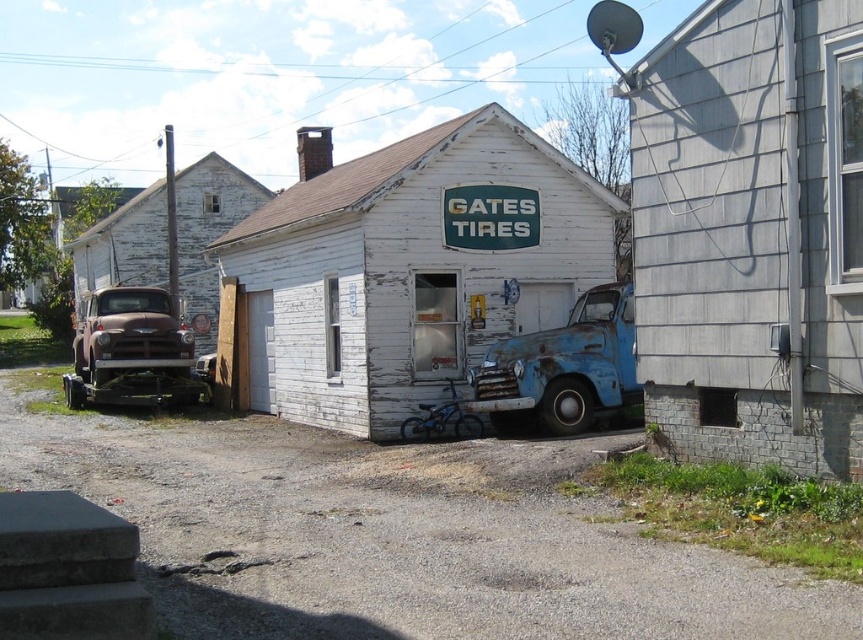
Question: Is gray shingles at right to the left of white weathered wood shed at center from the viewer's perspective?

Choices:
 (A) yes
 (B) no

Answer: (B)

Question: Can you confirm if white weathered wood shed at center is bigger than rusty metal truck at left?

Choices:
 (A) no
 (B) yes

Answer: (B)

Question: Among these objects, which one is nearest to the camera?

Choices:
 (A) white weathered wood shed at center
 (B) rusty metal truck at left
 (C) rusty metal truck at center
 (D) gray shingles at right

Answer: (D)

Question: Based on their relative distances, which object is nearer to the gray shingles at right?

Choices:
 (A) white weathered wood shed at center
 (B) rusty metal truck at left
 (C) rusty metal truck at center

Answer: (C)

Question: Based on their relative distances, which object is nearer to the gray shingles at right?

Choices:
 (A) white weathered wood shed at center
 (B) rusty metal truck at left

Answer: (A)

Question: Does gray shingles at right have a smaller size compared to rusty metal truck at left?

Choices:
 (A) no
 (B) yes

Answer: (A)